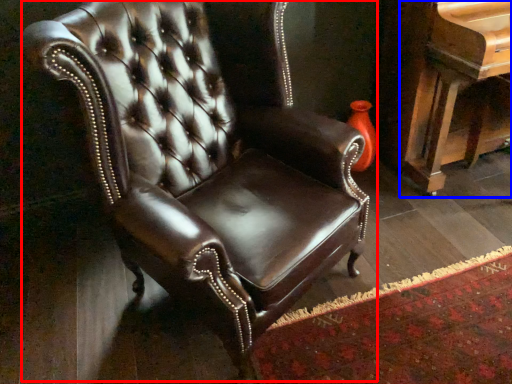
Question: Which of the following is the farthest to the observer, chair (highlighted by a red box) or piano (highlighted by a blue box)?

Choices:
 (A) chair
 (B) piano

Answer: (B)